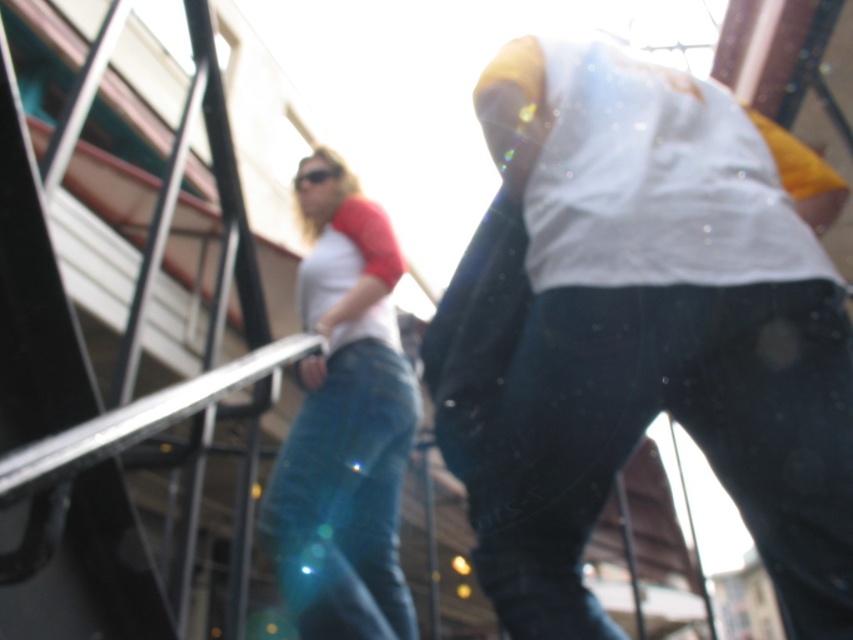
Question: Among these points, which one is nearest to the camera?

Choices:
 (A) (361, 634)
 (B) (772, 324)

Answer: (B)

Question: Does dark blue denim jeans at center appear under blue denim jeans at center?

Choices:
 (A) no
 (B) yes

Answer: (A)

Question: Does dark blue denim jeans at center appear on the left side of blue denim jeans at center?

Choices:
 (A) no
 (B) yes

Answer: (A)

Question: Does dark blue denim jeans at center have a greater width compared to blue denim jeans at center?

Choices:
 (A) yes
 (B) no

Answer: (A)

Question: Which of the following is the closest to the observer?

Choices:
 (A) (318, 499)
 (B) (798, 634)

Answer: (B)

Question: Which object is closer to the camera taking this photo?

Choices:
 (A) blue denim jeans at center
 (B) dark blue denim jeans at center

Answer: (B)